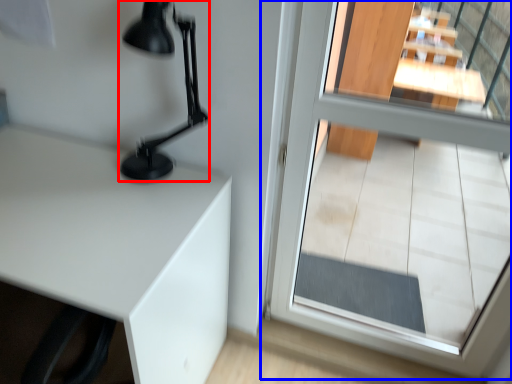
Question: Which object appears closest to the camera in this image, table lamp (highlighted by a red box) or glass door (highlighted by a blue box)?

Choices:
 (A) table lamp
 (B) glass door

Answer: (B)